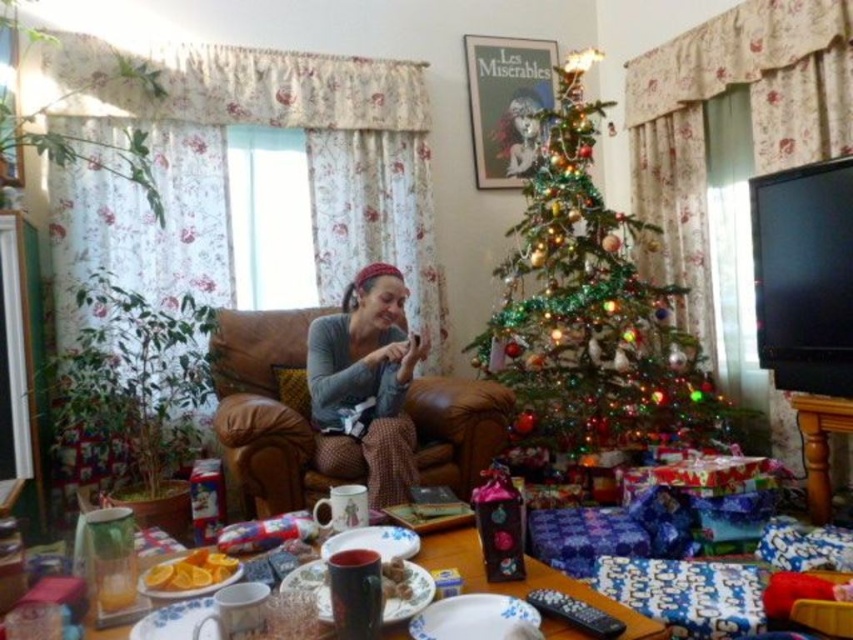
Is green shiny christmas tree at center taller than brown leather couch at center?

Indeed, green shiny christmas tree at center has a greater height compared to brown leather couch at center.

Is green shiny christmas tree at center to the left of brown leather couch at center from the viewer's perspective?

In fact, green shiny christmas tree at center is to the right of brown leather couch at center.

This screenshot has width=853, height=640. Identify the location of green shiny christmas tree at center. (590, 310).

Can you confirm if brown leather couch at center is smaller than gray knitted sweater at center?

No.

Can you confirm if brown leather couch at center is bigger than gray knitted sweater at center?

Correct, brown leather couch at center is larger in size than gray knitted sweater at center.

Where is `brown leather couch at center`? Image resolution: width=853 pixels, height=640 pixels. brown leather couch at center is located at coordinates (264, 412).

Who is taller, green shiny christmas tree at center or gray knitted sweater at center?

green shiny christmas tree at center is taller.

Is point (596, 326) closer to viewer compared to point (334, 464)?

No, (596, 326) is behind (334, 464).

You are a GUI agent. You are given a task and a screenshot of the screen. Output one action in this format:
    pyautogui.click(x=<x>, y=<y>)
    Task: Click on the green shiny christmas tree at center
    This screenshot has width=853, height=640.
    Given the screenshot: What is the action you would take?
    pyautogui.click(x=590, y=310)